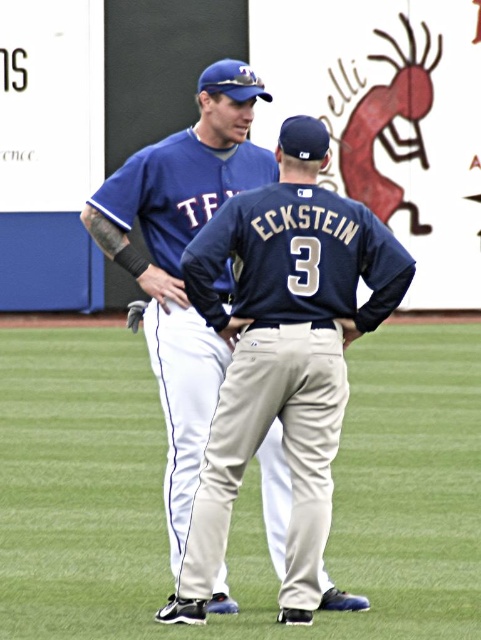
Does dark blue jersey at center appear on the right side of brown leather glove at center?

Yes, dark blue jersey at center is to the right of brown leather glove at center.

Looking at this image, is dark blue jersey at center further to the viewer compared to brown leather glove at center?

No, it is in front of brown leather glove at center.

Does point (211, 522) lie in front of point (136, 305)?

Yes, point (211, 522) is closer to viewer.

Where is `dark blue jersey at center`? dark blue jersey at center is located at coordinates point(283,355).

Can you confirm if dark blue jersey at center is wider than matte blue baseball cap at upper center?

Yes, dark blue jersey at center is wider than matte blue baseball cap at upper center.

This screenshot has height=640, width=481. Identify the location of dark blue jersey at center. (283, 355).

Which is in front, point (279, 387) or point (169, 456)?

Point (279, 387)

Where is `dark blue jersey at center`? This screenshot has width=481, height=640. dark blue jersey at center is located at coordinates pyautogui.click(x=283, y=355).

Does point (340, 451) lie in front of point (189, 371)?

No, (340, 451) is further to viewer.

Can you confirm if white fabric pants at center is positioned below matte blue baseball cap at upper center?

Yes.

You are a GUI agent. You are given a task and a screenshot of the screen. Output one action in this format:
    pyautogui.click(x=<x>, y=<y>)
    Task: Click on the white fabric pants at center
    The height and width of the screenshot is (640, 481).
    Given the screenshot: What is the action you would take?
    [239, 493]